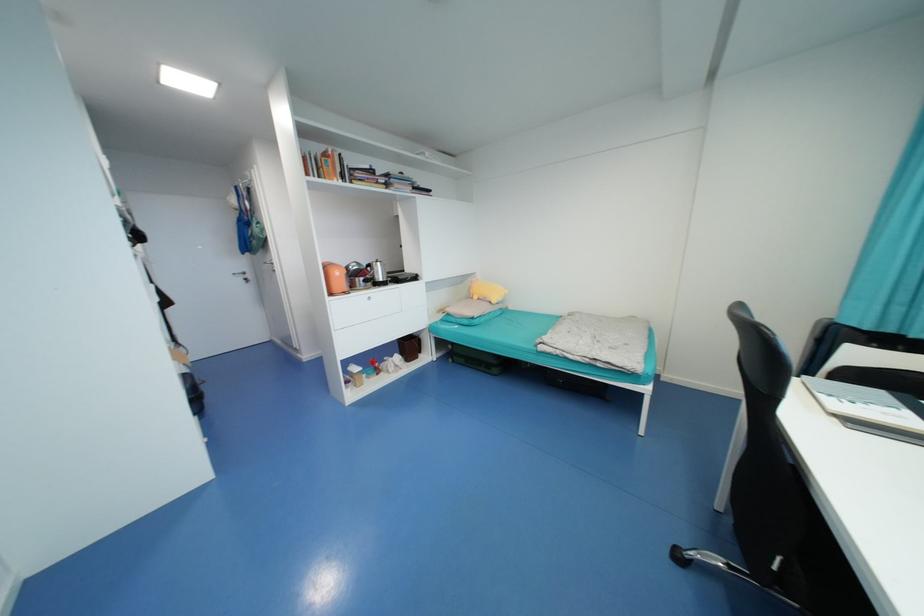
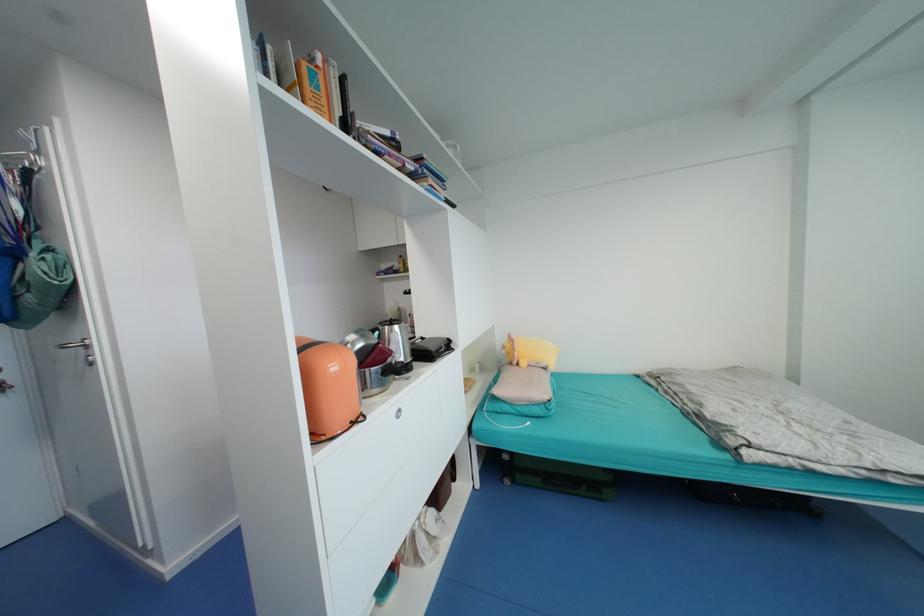
In the second image, find the point that corresponds to the point at 268,231 in the first image.

(68, 267)